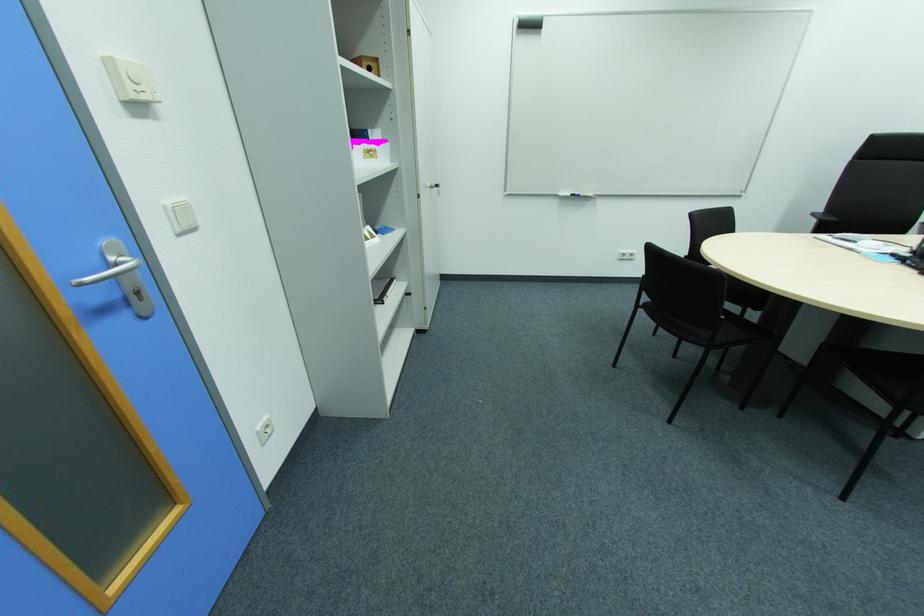
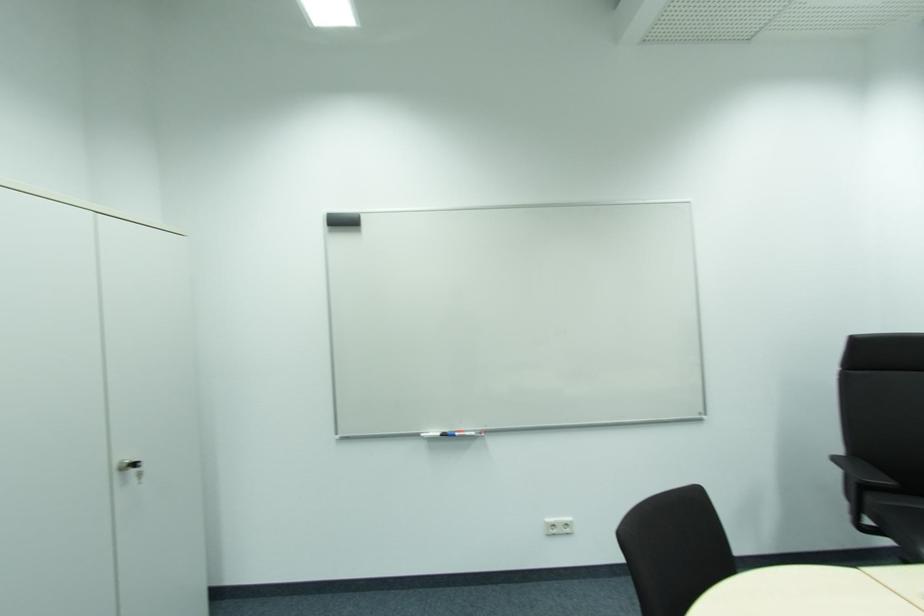
Where in the second image is the point corresponding to pixel 819 215 from the first image?

(842, 459)